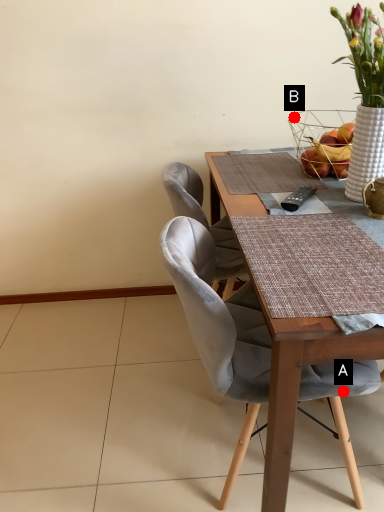
Question: Two points are circled on the image, labeled by A and B beside each circle. Which of the following is the farthest from the observer?

Choices:
 (A) A is further
 (B) B is further

Answer: (B)